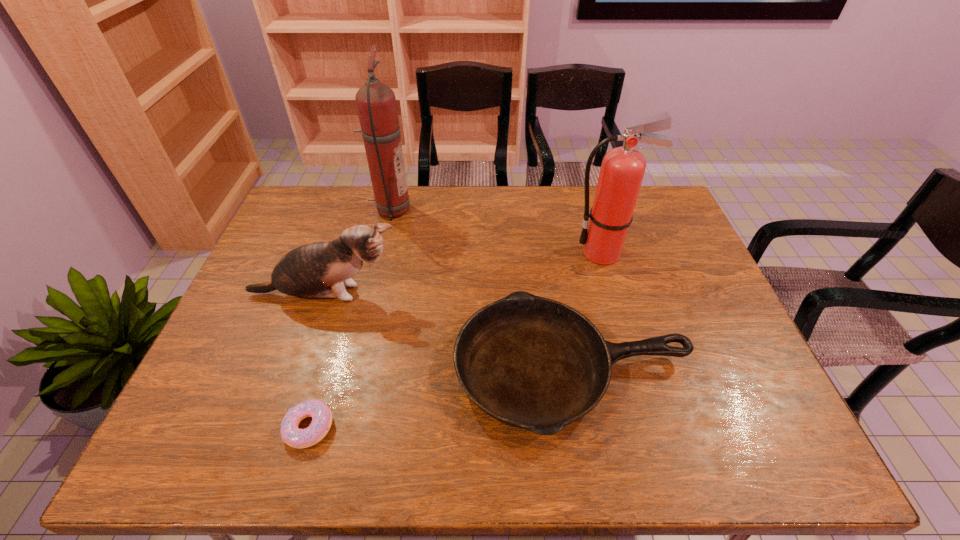
Find the location of a particular element. the left fire extinguisher is located at coordinates (376, 103).

This screenshot has height=540, width=960. What are the coordinates of `the farthest object` in the screenshot? It's located at (376, 103).

Find the location of `the right fire extinguisher`. the right fire extinguisher is located at coordinates (622, 170).

Where is `the second farthest object`? the second farthest object is located at coordinates (622, 170).

Where is `the third tallest object`? The height and width of the screenshot is (540, 960). the third tallest object is located at coordinates (304, 272).

Find the location of a particular element. This screenshot has height=540, width=960. the fourth tallest object is located at coordinates (530, 362).

Identify the location of the shortest object. The width and height of the screenshot is (960, 540). (321, 415).

Identify the location of vacant space located 0.260m on the side of the left fire extinguisher with the label and nozzle. (485, 210).

Image resolution: width=960 pixels, height=540 pixels. What are the coordinates of `free space located on the hose direction of the right fire extinguisher` in the screenshot? It's located at coord(470,253).

This screenshot has height=540, width=960. What are the coordinates of `vacant area located 0.310m on the hose direction of the right fire extinguisher` in the screenshot? It's located at (470, 253).